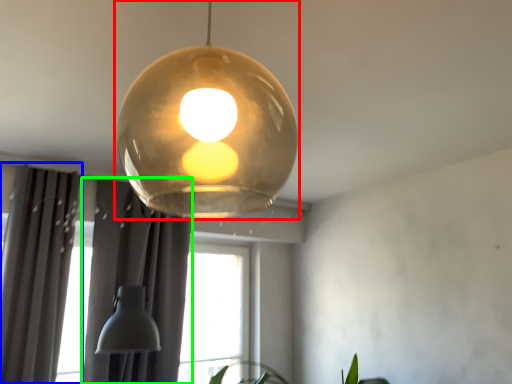
Question: Which object is the farthest from lamp (highlighted by a red box)? Choose among these: curtain (highlighted by a blue box) or curtain (highlighted by a green box).

Choices:
 (A) curtain
 (B) curtain

Answer: (A)